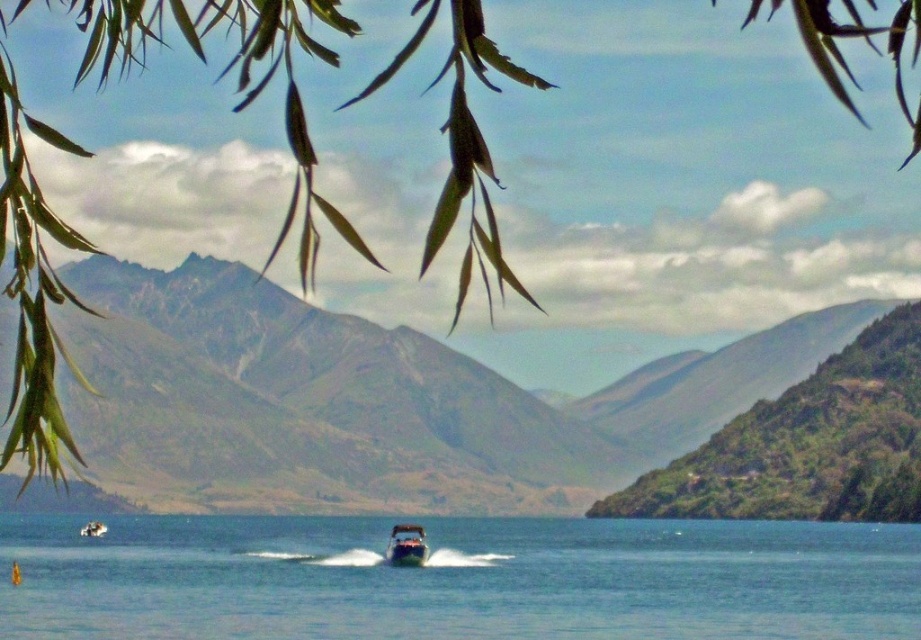
Question: Which of the following is the farthest from the observer?

Choices:
 (A) (183, 604)
 (B) (103, 532)
 (C) (420, 536)

Answer: (B)

Question: Which point appears farthest from the camera in this image?

Choices:
 (A) (905, 570)
 (B) (394, 524)
 (C) (103, 529)

Answer: (C)

Question: Does shiny metallic boat at center appear over metallic silver boat at center?

Choices:
 (A) yes
 (B) no

Answer: (A)

Question: Does clear blue water at center have a lesser width compared to shiny metallic boat at center?

Choices:
 (A) no
 (B) yes

Answer: (A)

Question: Is clear blue water at center positioned at the back of shiny metallic boat at center?

Choices:
 (A) no
 (B) yes

Answer: (A)

Question: Which of the following is the closest to the observer?

Choices:
 (A) metallic silver boat at center
 (B) clear blue water at center
 (C) shiny metallic boat at center

Answer: (B)